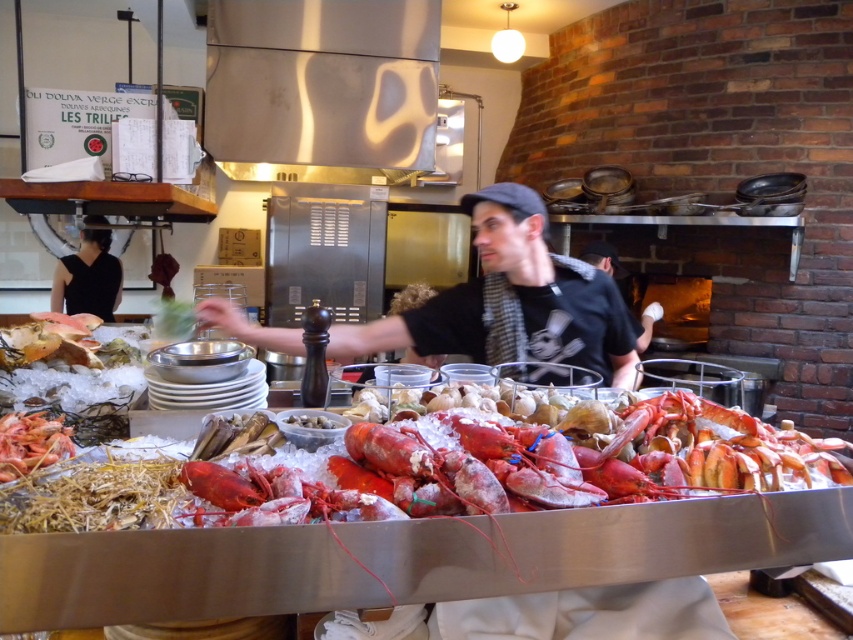
Question: Can you confirm if black matte shirt at upper left is positioned below white matte shell at center?

Choices:
 (A) no
 (B) yes

Answer: (A)

Question: Which point appears farthest from the camera in this image?

Choices:
 (A) (289, 422)
 (B) (56, 262)

Answer: (B)

Question: Is black matte shirt at upper left to the right of white matte shell at center from the viewer's perspective?

Choices:
 (A) no
 (B) yes

Answer: (A)

Question: Which object is farther from the camera taking this photo?

Choices:
 (A) black matte shirt at upper left
 (B) white matte shell at center

Answer: (A)

Question: Which point appears farthest from the camera in this image?

Choices:
 (A) (292, 346)
 (B) (308, 426)
 (C) (196, 554)

Answer: (A)

Question: Does shiny red lobster at center appear on the right side of matte black shirt at center?

Choices:
 (A) no
 (B) yes

Answer: (A)